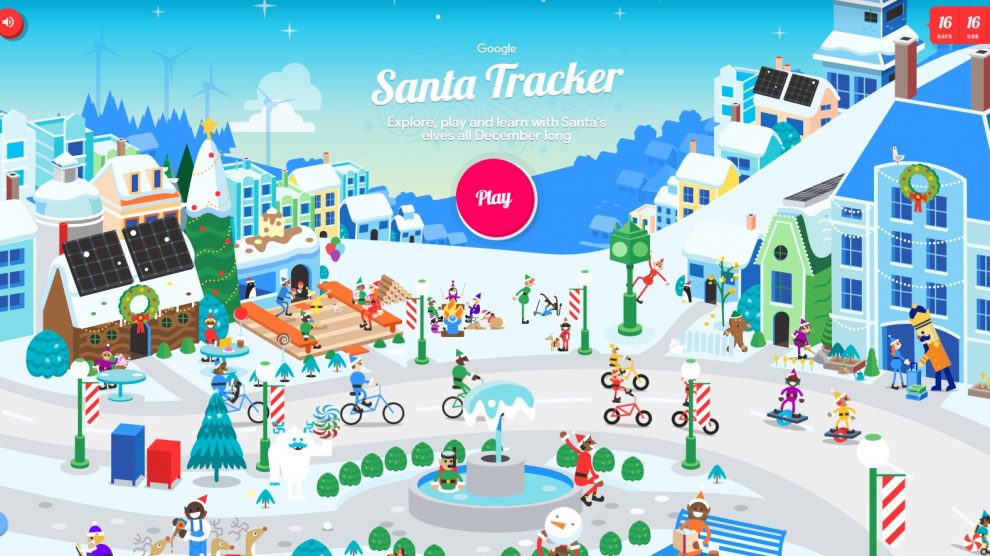
The image size is (990, 556). Identify the location of gold star on top of christmas tree. (210, 125).